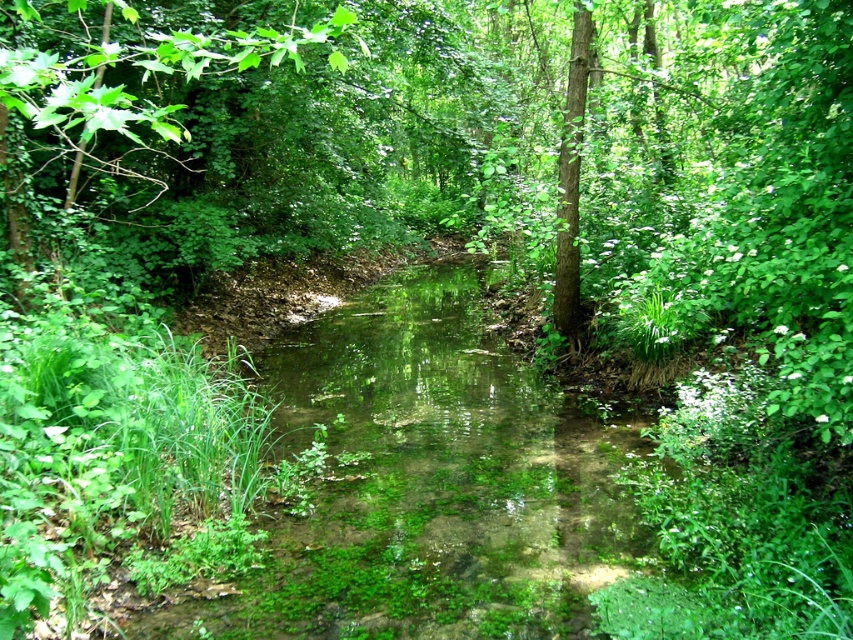
Is green mossy stream at center above green leafy tree at upper left?

No.

Is green mossy stream at center bigger than green leafy tree at upper left?

Actually, green mossy stream at center might be smaller than green leafy tree at upper left.

This screenshot has width=853, height=640. I want to click on green mossy stream at center, so click(x=428, y=483).

Where is `green mossy stream at center`? This screenshot has width=853, height=640. green mossy stream at center is located at coordinates (428, 483).

Does green mossy stream at center appear on the left side of green rough bark tree at center?

Yes, green mossy stream at center is to the left of green rough bark tree at center.

You are a GUI agent. You are given a task and a screenshot of the screen. Output one action in this format:
    pyautogui.click(x=<x>, y=<y>)
    Task: Click on the green mossy stream at center
    The height and width of the screenshot is (640, 853).
    Given the screenshot: What is the action you would take?
    pyautogui.click(x=428, y=483)

Where is `green mossy stream at center`? green mossy stream at center is located at coordinates (428, 483).

Between green leafy tree at upper left and green rough bark tree at center, which one appears on the right side from the viewer's perspective?

green rough bark tree at center

Is green leafy tree at upper left bigger than green rough bark tree at center?

Indeed, green leafy tree at upper left has a larger size compared to green rough bark tree at center.

This screenshot has height=640, width=853. What do you see at coordinates (125, 124) in the screenshot?
I see `green leafy tree at upper left` at bounding box center [125, 124].

You are a GUI agent. You are given a task and a screenshot of the screen. Output one action in this format:
    pyautogui.click(x=<x>, y=<y>)
    Task: Click on the green leafy tree at upper left
    
    Given the screenshot: What is the action you would take?
    pyautogui.click(x=125, y=124)